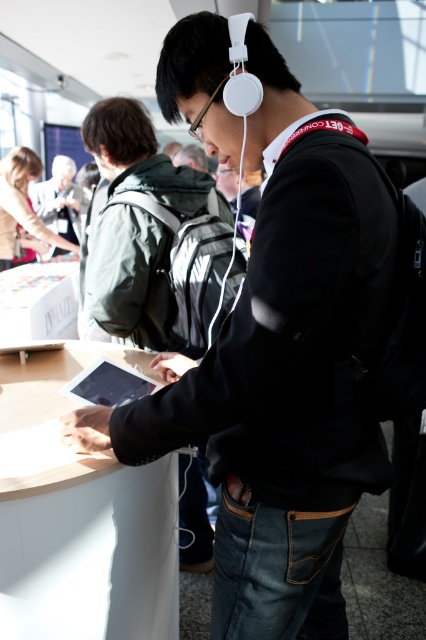
Question: Which object is closer to the camera taking this photo?

Choices:
 (A) white matte table at center
 (B) matte black backpack at upper left
 (C) white cardboard box at lower left
 (D) matte black tablet at center

Answer: (A)

Question: Is white cardboard box at lower left above matte black tablet at center?

Choices:
 (A) no
 (B) yes

Answer: (B)

Question: Does white matte table at center appear over white cardboard box at lower left?

Choices:
 (A) no
 (B) yes

Answer: (A)

Question: Which of the following is the farthest from the observer?

Choices:
 (A) (81, 390)
 (B) (43, 184)
 (C) (3, 275)

Answer: (B)

Question: Among these objects, which one is farthest from the camera?

Choices:
 (A) matte black tablet at center
 (B) white cardboard box at lower left

Answer: (B)

Question: Is white cardboard box at lower left closer to the viewer compared to matte black tablet at center?

Choices:
 (A) yes
 (B) no

Answer: (B)